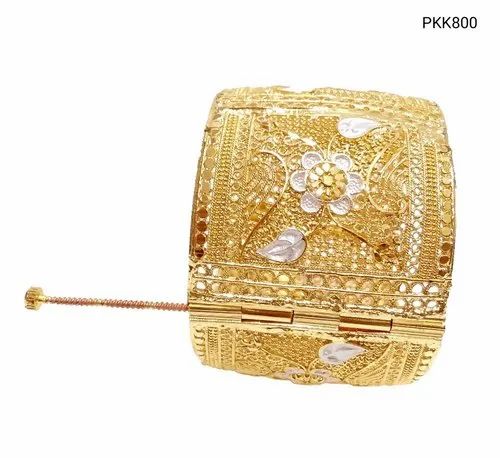
Locate an element on the screen. The image size is (500, 458). ornate details is located at coordinates (201, 202), (266, 279), (431, 241).